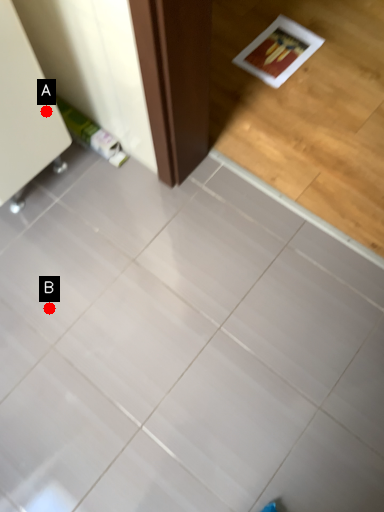
Question: Two points are circled on the image, labeled by A and B beside each circle. Which point is closer to the camera?

Choices:
 (A) A is closer
 (B) B is closer

Answer: (A)